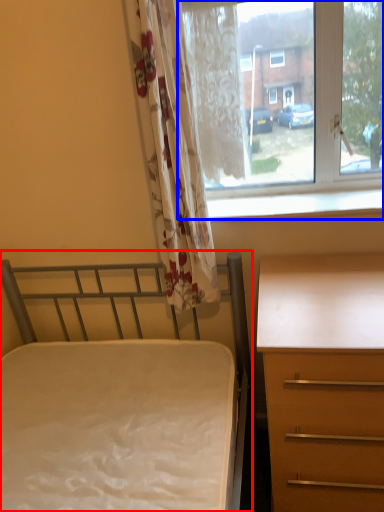
Question: Which of the following is the farthest to the observer, bed (highlighted by a red box) or window (highlighted by a blue box)?

Choices:
 (A) bed
 (B) window

Answer: (B)